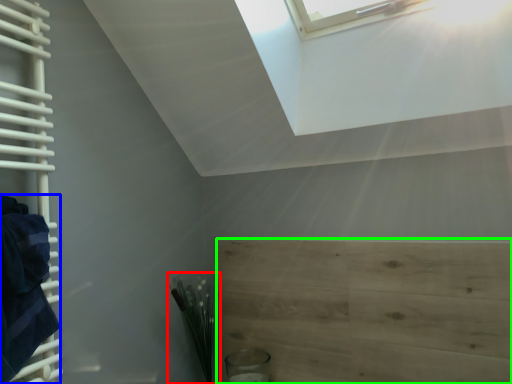
Question: Which is nearer to the plant (highlighted by a red box)? blanket (highlighted by a blue box) or plywood (highlighted by a green box).

Choices:
 (A) blanket
 (B) plywood

Answer: (B)